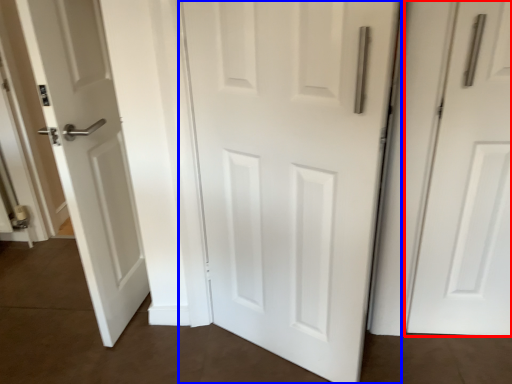
Question: Which object appears farthest to the camera in this image, door (highlighted by a red box) or door (highlighted by a blue box)?

Choices:
 (A) door
 (B) door

Answer: (A)